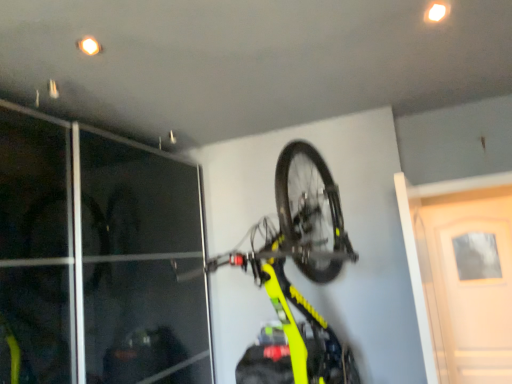
What do you see at coordinates (298, 256) in the screenshot? I see `yellow matte bicycle at center` at bounding box center [298, 256].

What is the approximate width of yellow matte bicycle at center?

yellow matte bicycle at center is 3.53 feet in width.

This screenshot has width=512, height=384. Identify the location of yellow matte bicycle at center. 298,256.

Identify the location of yellow matte bicycle at center. This screenshot has width=512, height=384. (298, 256).